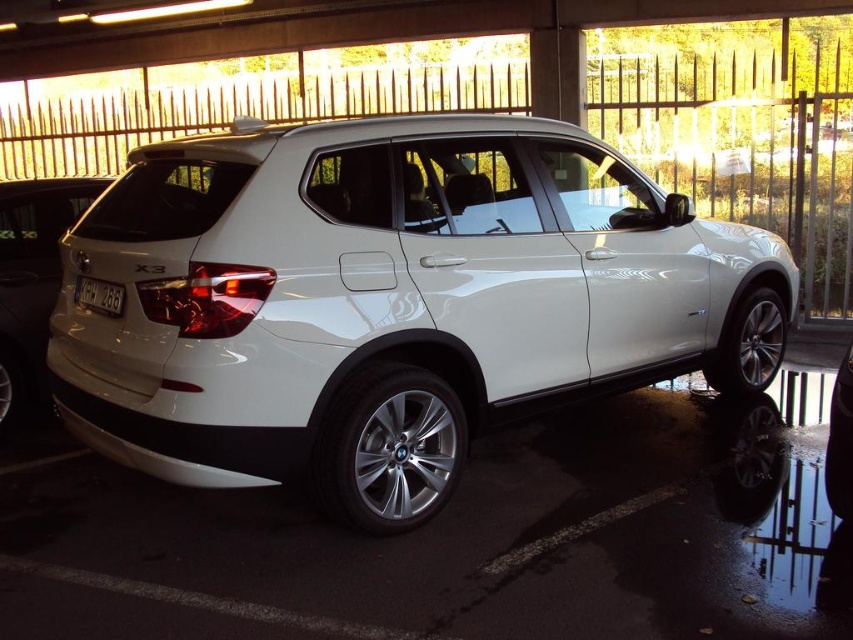
Which is behind, point (55, 566) or point (76, 280)?

Positioned behind is point (76, 280).

Can you confirm if white glossy car at center is wider than white plastic license plate at rear?

Yes, white glossy car at center is wider than white plastic license plate at rear.

Identify the location of white glossy car at center. (456, 540).

Locate an element on the screen. The width and height of the screenshot is (853, 640). white glossy suv at center is located at coordinates (390, 301).

Which is in front, point (381, 376) or point (433, 561)?

Positioned in front is point (433, 561).

Between point (265, 460) and point (3, 552), which one is positioned in front?

Point (265, 460)

At what (x,y) coordinates should I click in order to perform the action: click on white glossy suv at center. Please return your answer as a coordinate pair (x, y). The height and width of the screenshot is (640, 853). Looking at the image, I should click on (390, 301).

Can you confirm if white glossy minivan at lower left is taller than white plastic license plate at rear?

Indeed, white glossy minivan at lower left has a greater height compared to white plastic license plate at rear.

Between white glossy minivan at lower left and white plastic license plate at rear, which one is positioned higher?

white glossy minivan at lower left is above.

Find the location of `white glossy minivan at lower left`. white glossy minivan at lower left is located at coordinates (32, 280).